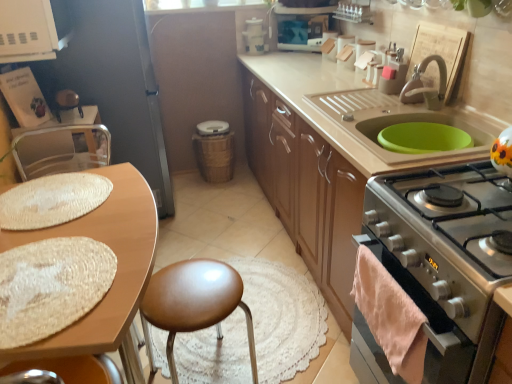
Identify the location of vacant space underneath brown leather stool at center (from a real-world perspective). Image resolution: width=512 pixels, height=384 pixels. (x=212, y=364).